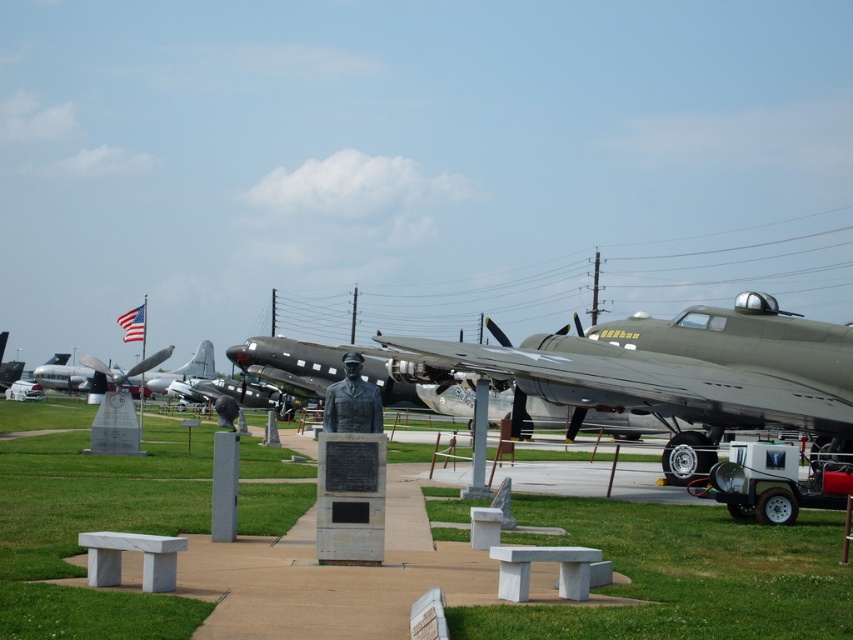
Question: Is green matte airplane at center positioned behind silver metallic airplane at center?

Choices:
 (A) no
 (B) yes

Answer: (A)

Question: Does green grass at center appear on the right side of silver metallic airplane at center?

Choices:
 (A) no
 (B) yes

Answer: (B)

Question: Which object is the farthest from the bronze statue at center?

Choices:
 (A) silver metallic airplane at center
 (B) green grass at center

Answer: (A)

Question: Which point is closer to the camera?

Choices:
 (A) (374, 392)
 (B) (206, 364)

Answer: (A)

Question: Does green matte airplane at center have a greater width compared to bronze statue at center?

Choices:
 (A) yes
 (B) no

Answer: (B)

Question: Which object is farther from the camera taking this photo?

Choices:
 (A) bronze statue at center
 (B) green grass at center
 (C) silver metallic airplane at center
 (D) green matte airplane at center

Answer: (C)